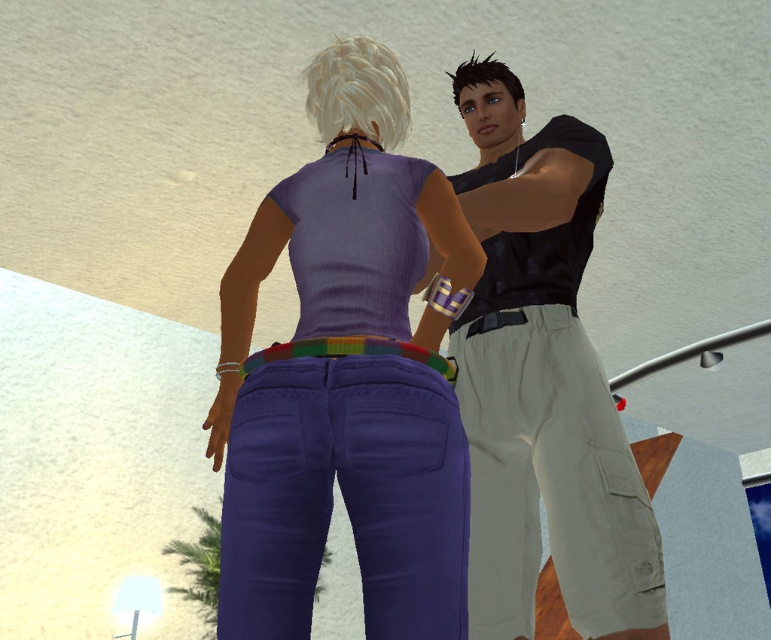
Does purple matte jeans at center appear over black matte tank top at center?

No.

Between purple matte jeans at center and black matte tank top at center, which one has less height?

purple matte jeans at center

Find the location of a particular element. Image resolution: width=771 pixels, height=640 pixels. purple matte jeans at center is located at coordinates (345, 376).

Does black matte tank top at center have a smaller size compared to multicolored woven belt at center?

No, black matte tank top at center is not smaller than multicolored woven belt at center.

Is black matte tank top at center wider than multicolored woven belt at center?

Indeed, black matte tank top at center has a greater width compared to multicolored woven belt at center.

Where is `black matte tank top at center`? Image resolution: width=771 pixels, height=640 pixels. black matte tank top at center is located at coordinates (541, 384).

The height and width of the screenshot is (640, 771). In order to click on black matte tank top at center in this screenshot , I will do `click(541, 384)`.

Between point (416, 262) and point (394, 355), which one is positioned behind?

Positioned behind is point (416, 262).

Which is more to the left, purple matte jeans at center or multicolored woven belt at center?

Positioned to the left is purple matte jeans at center.

Is point (433, 240) closer to camera compared to point (280, 355)?

No.

The image size is (771, 640). Find the location of `purple matte jeans at center`. purple matte jeans at center is located at coordinates tap(345, 376).